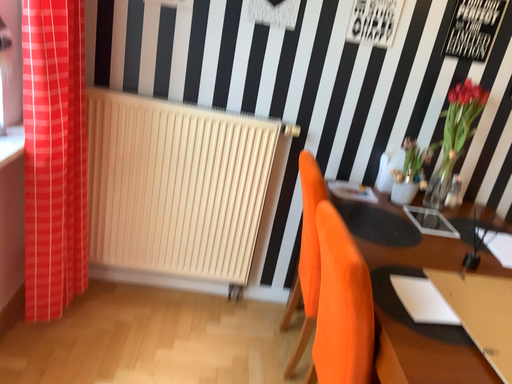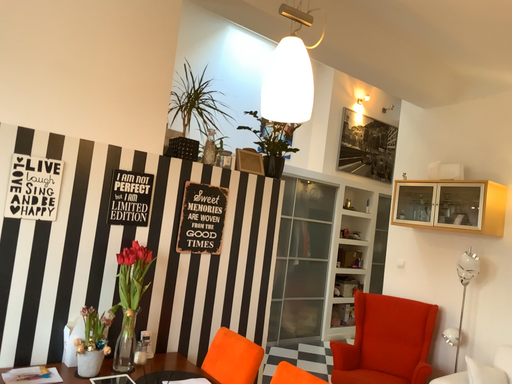
Question: Which way did the camera rotate in the video?

Choices:
 (A) rotated downward
 (B) rotated upward

Answer: (B)